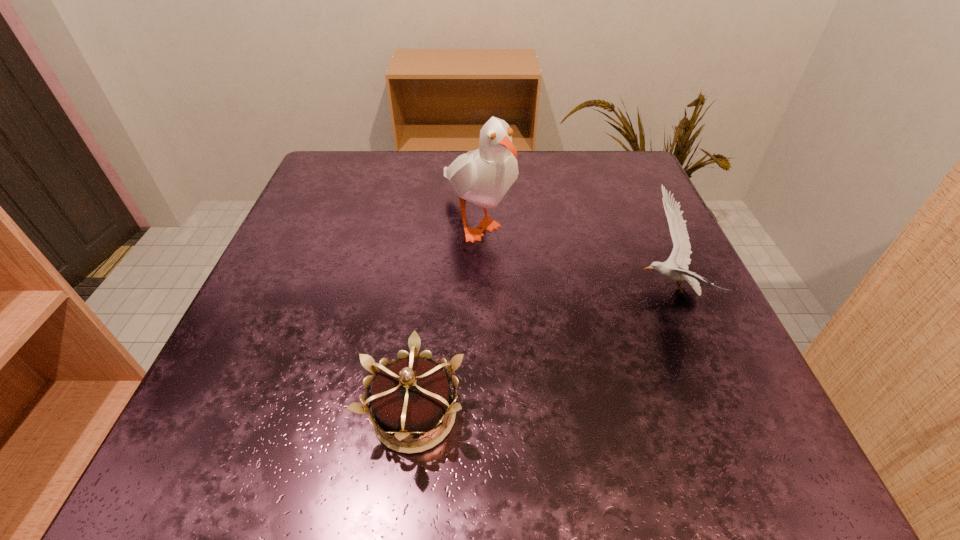
Identify which object is the nearest to the right gull. Please provide its 2D coordinates. Your answer should be formatted as a tuple, i.e. [(x, y)], where the tuple contains the x and y coordinates of a point satisfying the conditions above.

[(483, 176)]

What are the coordinates of `vacant area in the image that satisfies the following two spatial constraints: 1. at the tip of the beak of the right gull; 2. on the front side of the shortest object` in the screenshot? It's located at (720, 415).